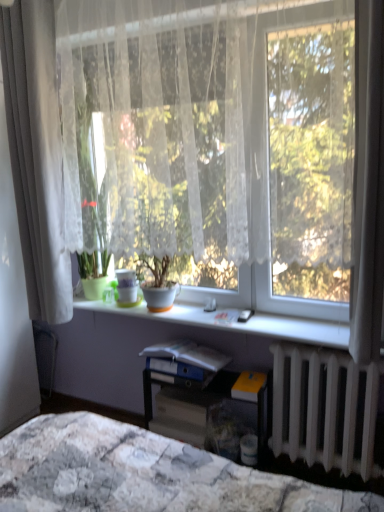
Where is `free location above white glossy window sill at center (from a real-world perspective)`? This screenshot has width=384, height=512. free location above white glossy window sill at center (from a real-world perspective) is located at coordinates (228, 318).